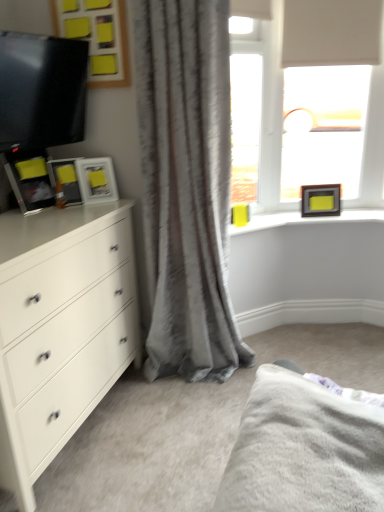
Locate an element on the screen. Image resolution: width=384 pixels, height=512 pixels. vacant space in front of matte black picture frame at left, the 3th picture frame in the back-to-front sequence is located at coordinates (66, 211).